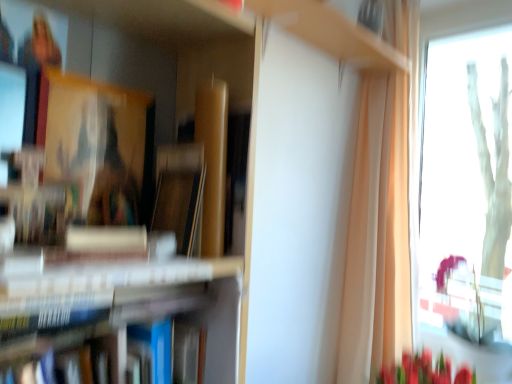
Question: From the image's perspective, would you say transparent glass window at right is positioned over hardcover books at left?

Choices:
 (A) no
 (B) yes

Answer: (B)

Question: Considering the relative positions of transparent glass window at right and hardcover books at left in the image provided, is transparent glass window at right behind hardcover books at left?

Choices:
 (A) yes
 (B) no

Answer: (A)

Question: Is transparent glass window at right looking in the opposite direction of hardcover books at left?

Choices:
 (A) no
 (B) yes

Answer: (A)

Question: Considering the relative sizes of transparent glass window at right and hardcover books at left in the image provided, is transparent glass window at right wider than hardcover books at left?

Choices:
 (A) yes
 (B) no

Answer: (B)

Question: Is transparent glass window at right thinner than hardcover books at left?

Choices:
 (A) yes
 (B) no

Answer: (A)

Question: Looking at their shapes, would you say transparent glass window at right is wider or thinner than hardcover books at left?

Choices:
 (A) wide
 (B) thin

Answer: (B)

Question: From the image's perspective, is transparent glass window at right positioned above or below hardcover books at left?

Choices:
 (A) above
 (B) below

Answer: (A)

Question: From a real-world perspective, is transparent glass window at right above or below hardcover books at left?

Choices:
 (A) below
 (B) above

Answer: (B)

Question: In terms of height, does transparent glass window at right look taller or shorter compared to hardcover books at left?

Choices:
 (A) short
 (B) tall

Answer: (B)

Question: From the image's perspective, is wooden cabinet at upper center above or below transparent glass window at right?

Choices:
 (A) below
 (B) above

Answer: (B)

Question: Is wooden cabinet at upper center to the left or to the right of transparent glass window at right in the image?

Choices:
 (A) left
 (B) right

Answer: (A)

Question: Does point (408, 64) appear closer or farther from the camera than point (454, 82)?

Choices:
 (A) farther
 (B) closer

Answer: (B)

Question: From their relative heights in the image, would you say wooden cabinet at upper center is taller or shorter than transparent glass window at right?

Choices:
 (A) tall
 (B) short

Answer: (B)

Question: Considering their positions, is transparent glass window at right located in front of or behind wooden cabinet at upper center?

Choices:
 (A) behind
 (B) front

Answer: (A)

Question: Is transparent glass window at right taller or shorter than wooden cabinet at upper center?

Choices:
 (A) tall
 (B) short

Answer: (A)